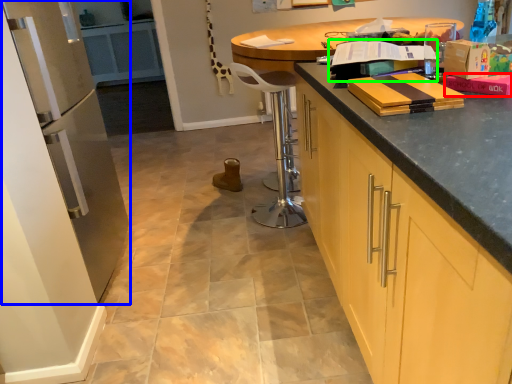
Question: Based on their relative distances, which object is farther from book (highlighted by a red box)? Choose from appliance (highlighted by a blue box) and book (highlighted by a green box).

Choices:
 (A) appliance
 (B) book

Answer: (A)